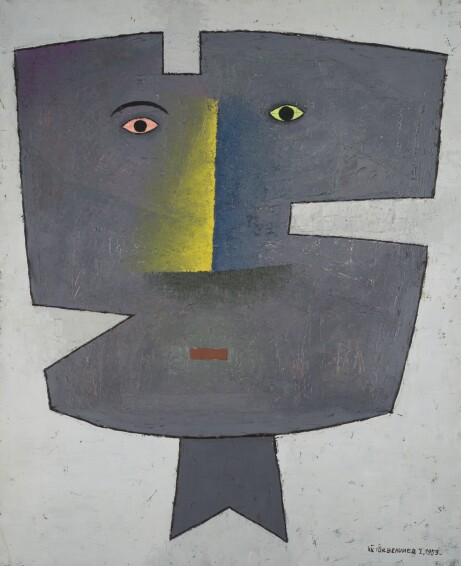
This screenshot has width=461, height=566. What are the coordinates of `gray background on painting` in the screenshot? It's located at (397, 484).